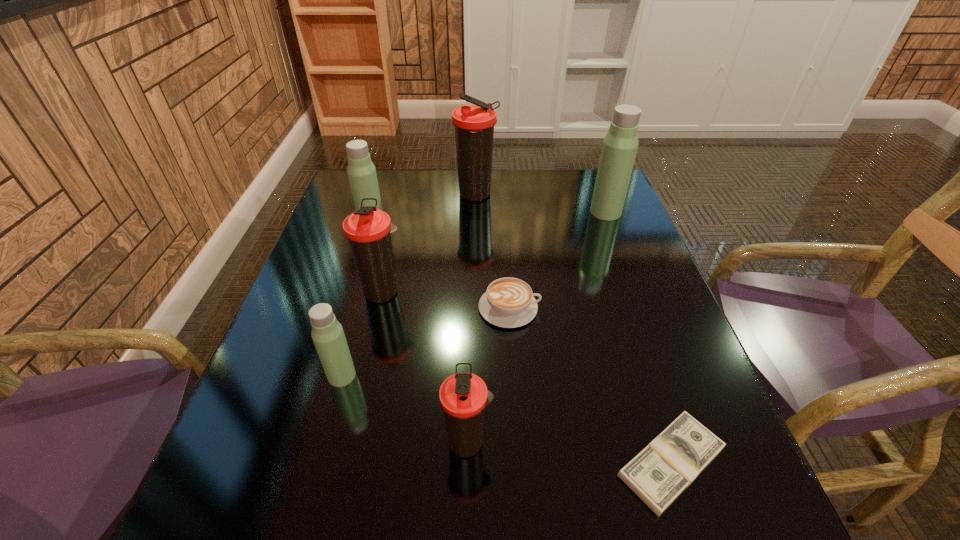
Where is `cappuccino`? Image resolution: width=960 pixels, height=540 pixels. cappuccino is located at coordinates (509, 302).

In order to click on the shortest object in this screenshot , I will do `click(660, 472)`.

Identify the location of vacant space situated 0.070m on the back of the biggest brown thermos bottle. (476, 172).

Image resolution: width=960 pixels, height=540 pixels. Identify the location of blank space located 0.100m on the back of the rightmost thermos bottle. (596, 186).

Image resolution: width=960 pixels, height=540 pixels. Find the location of `vacant position located on the front of the second smallest light thermos bottle`. vacant position located on the front of the second smallest light thermos bottle is located at coordinates (361, 261).

The height and width of the screenshot is (540, 960). In order to click on free region located 0.360m on the front of the second smallest brown thermos bottle in this screenshot , I will do `click(343, 468)`.

Where is `vacant space located 0.090m on the front of the third nearest object`? Image resolution: width=960 pixels, height=540 pixels. vacant space located 0.090m on the front of the third nearest object is located at coordinates (326, 431).

The height and width of the screenshot is (540, 960). In order to click on free space located 0.390m on the right of the nearest thermos bottle in this screenshot , I will do [x=721, y=442].

Locate an element on the screen. vacant space located on the side of the second shortest object with the handle is located at coordinates (621, 308).

The height and width of the screenshot is (540, 960). I want to click on vacant space positioned 0.090m on the back of the dollar, so click(x=642, y=374).